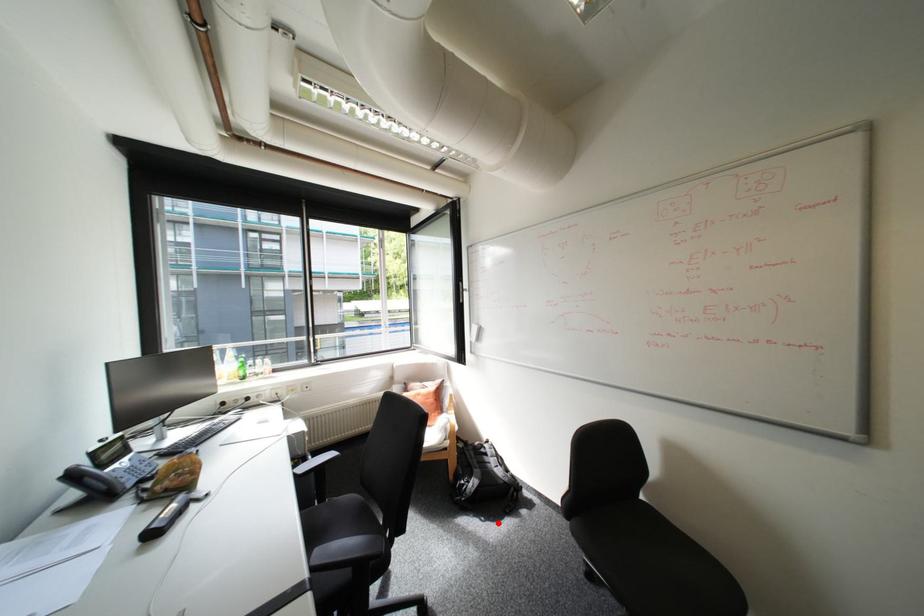
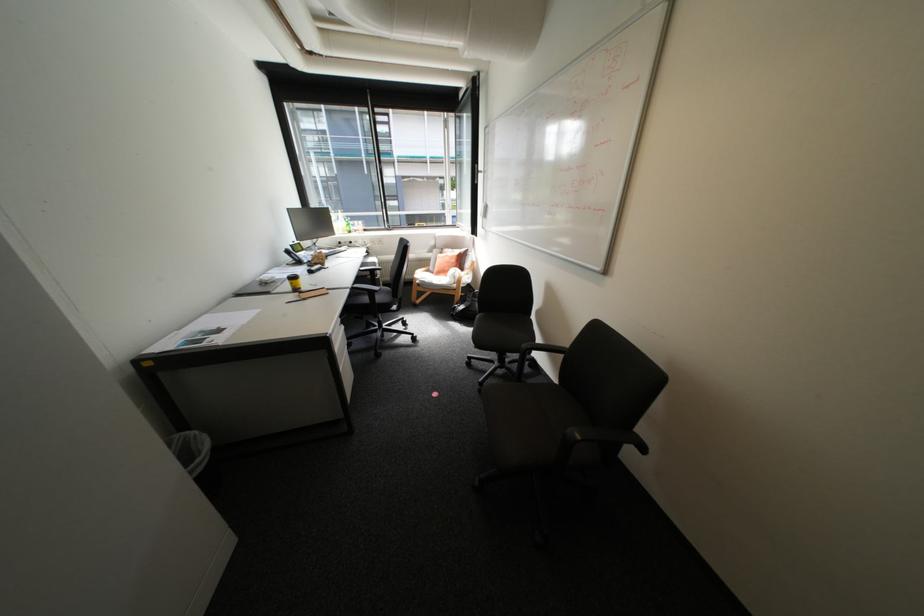
The point at the highlighted location is marked in the first image. Where is the corresponding point in the second image?

(473, 326)